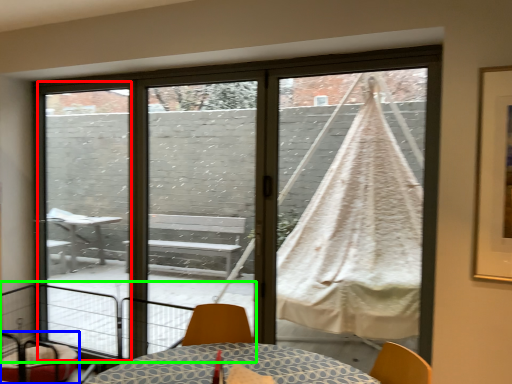
Question: Based on their relative distances, which object is farther from screen door (highlighted by a red box)? Choose from furniture (highlighted by a blue box) and balcony (highlighted by a green box).

Choices:
 (A) furniture
 (B) balcony

Answer: (A)